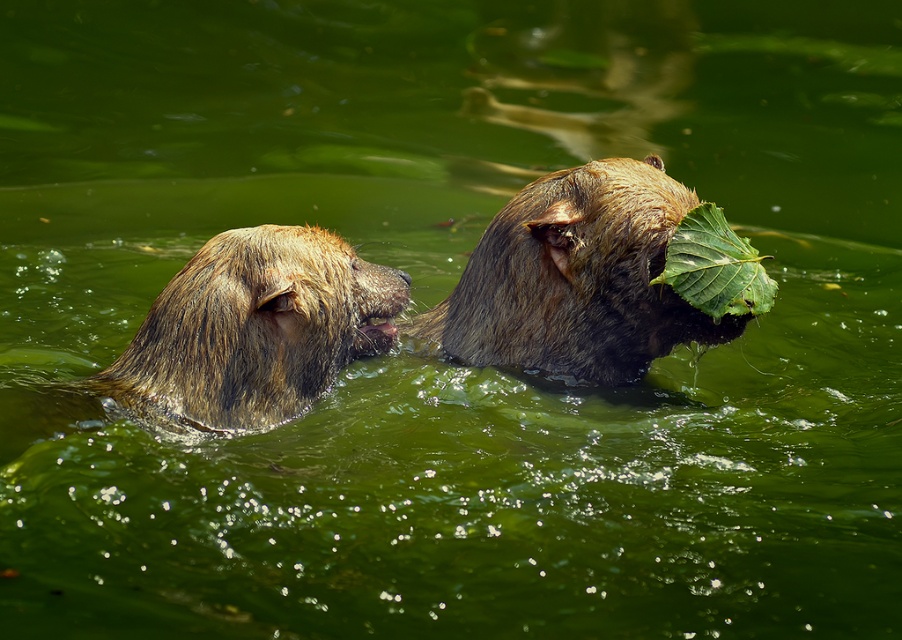
Who is lower down, brown furry bear at upper center or green leafy at right?

brown furry bear at upper center

Consider the image. Which of these two, brown furry bear at upper center or green leafy at right, stands taller?

brown furry bear at upper center

I want to click on brown furry bear at upper center, so click(x=576, y=278).

Is brown fur bear at left closer to the viewer compared to green leafy at right?

Yes, it is.

Is brown fur bear at left below green leafy at right?

Indeed, brown fur bear at left is positioned under green leafy at right.

Does point (122, 368) lie in front of point (723, 241)?

Yes.

In order to click on brown fur bear at left in this screenshot , I will do `click(254, 330)`.

The width and height of the screenshot is (902, 640). In order to click on brown furry bear at upper center in this screenshot , I will do `click(576, 278)`.

Is point (536, 310) positioned in front of point (205, 333)?

No.

The width and height of the screenshot is (902, 640). Find the location of `brown furry bear at upper center`. brown furry bear at upper center is located at coordinates (576, 278).

Locate an element on the screen. brown furry bear at upper center is located at coordinates (576, 278).